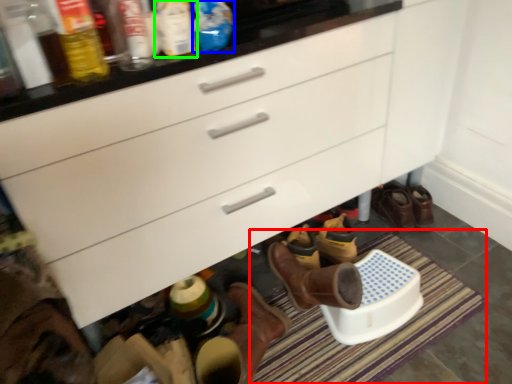
Question: Which object is positioned farthest from bath mat (highlighted by a red box)? Select from bottle (highlighted by a blue box) and bottle (highlighted by a green box).

Choices:
 (A) bottle
 (B) bottle

Answer: (B)